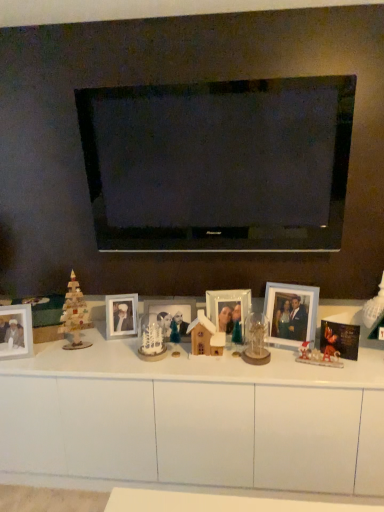
Locate an element on the screen. blank area to the left of metallic gold ornament at center-right, positioned as the 3th toy in left-to-right order is located at coordinates (285, 362).